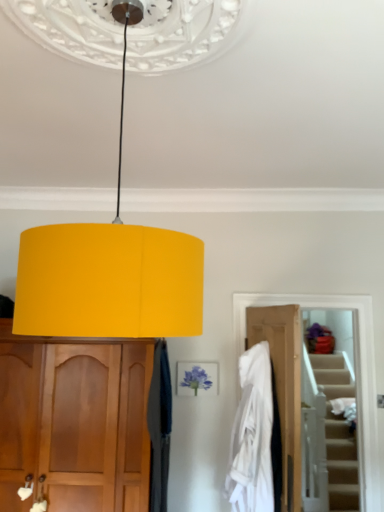
Question: Can you confirm if matte yellow lampshade at center is shorter than velvet dark blue curtain at center?

Choices:
 (A) yes
 (B) no

Answer: (A)

Question: Is matte yellow lampshade at center outside of velvet dark blue curtain at center?

Choices:
 (A) no
 (B) yes

Answer: (B)

Question: Is matte yellow lampshade at center looking in the opposite direction of velvet dark blue curtain at center?

Choices:
 (A) no
 (B) yes

Answer: (A)

Question: Considering the relative sizes of matte yellow lampshade at center and velvet dark blue curtain at center in the image provided, is matte yellow lampshade at center bigger than velvet dark blue curtain at center?

Choices:
 (A) no
 (B) yes

Answer: (B)

Question: From a real-world perspective, is matte yellow lampshade at center under velvet dark blue curtain at center?

Choices:
 (A) yes
 (B) no

Answer: (B)

Question: From the image's perspective, is matte yellow lampshade at center above velvet dark blue curtain at center?

Choices:
 (A) no
 (B) yes

Answer: (B)

Question: Does white fabric at center come behind wooden door at lower right?

Choices:
 (A) yes
 (B) no

Answer: (B)

Question: Would you say white fabric at center contains wooden door at lower right?

Choices:
 (A) yes
 (B) no

Answer: (B)

Question: Does white fabric at center come in front of wooden door at lower right?

Choices:
 (A) no
 (B) yes

Answer: (B)

Question: Considering the relative positions of white fabric at center and wooden door at lower right in the image provided, is white fabric at center to the right of wooden door at lower right from the viewer's perspective?

Choices:
 (A) yes
 (B) no

Answer: (B)

Question: Considering the relative positions of white fabric at center and wooden door at lower right in the image provided, is white fabric at center to the left of wooden door at lower right from the viewer's perspective?

Choices:
 (A) no
 (B) yes

Answer: (B)

Question: Is white fabric at center with wooden door at lower right?

Choices:
 (A) no
 (B) yes

Answer: (A)

Question: Considering the relative sizes of matte yellow lampshade at center and matte wood cabinet at left in the image provided, is matte yellow lampshade at center taller than matte wood cabinet at left?

Choices:
 (A) no
 (B) yes

Answer: (A)